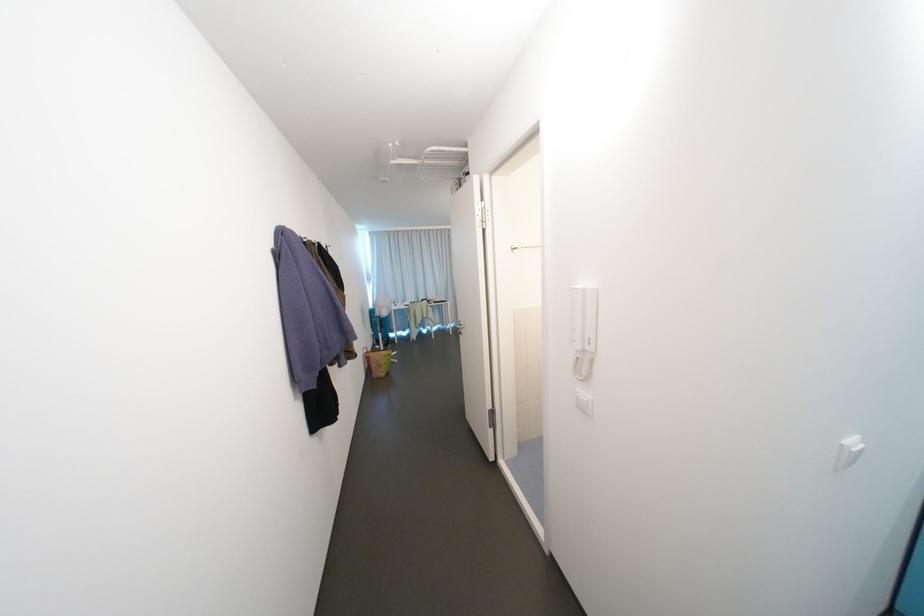
You are a GUI agent. You are given a task and a screenshot of the screen. Output one action in this format:
    pyautogui.click(x=<x>, y=<y>)
    Task: Click on the brown paper bag
    The height and width of the screenshot is (616, 924).
    Given the screenshot: What is the action you would take?
    pyautogui.click(x=378, y=362)